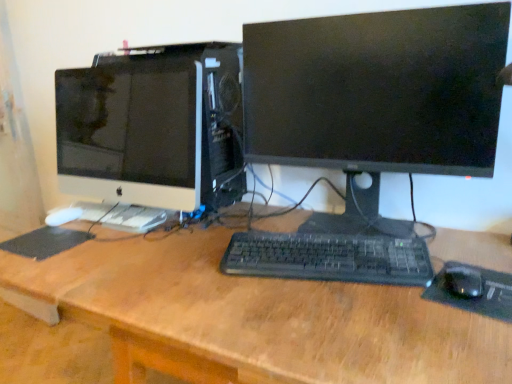
Locate an element on the screen. Image resolution: width=512 pixels, height=384 pixels. empty space that is ontop of wooden desk at center is located at coordinates (227, 265).